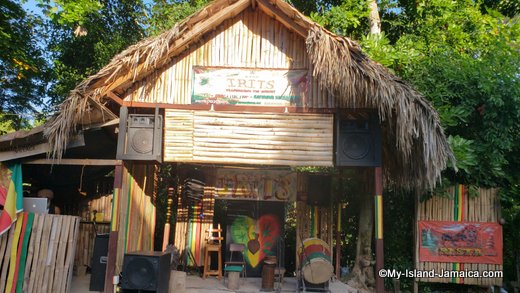
At what (x,y) coordinates should I click in order to perform the action: click on speakers. Please return your answer as a coordinate pair (x, y). This screenshot has width=520, height=293. Looking at the image, I should click on (352, 147), (137, 140), (151, 275).